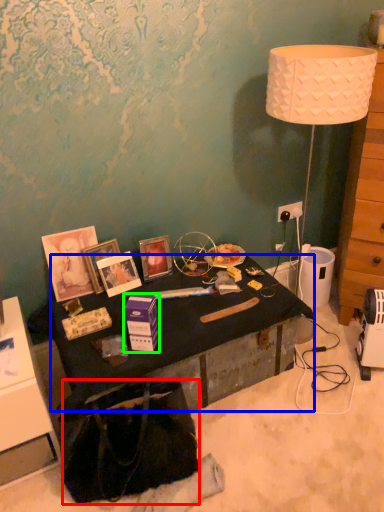
Question: Which object is positioned closest to handbag (highlighted by a red box)? Select from desk (highlighted by a blue box) and box (highlighted by a green box).

Choices:
 (A) desk
 (B) box

Answer: (A)